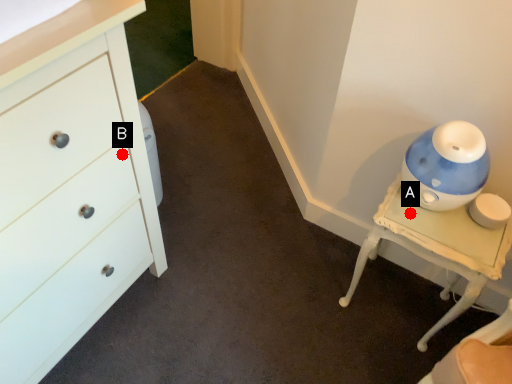
Question: Two points are circled on the image, labeled by A and B beside each circle. Which point appears farthest from the camera in this image?

Choices:
 (A) A is further
 (B) B is further

Answer: (A)